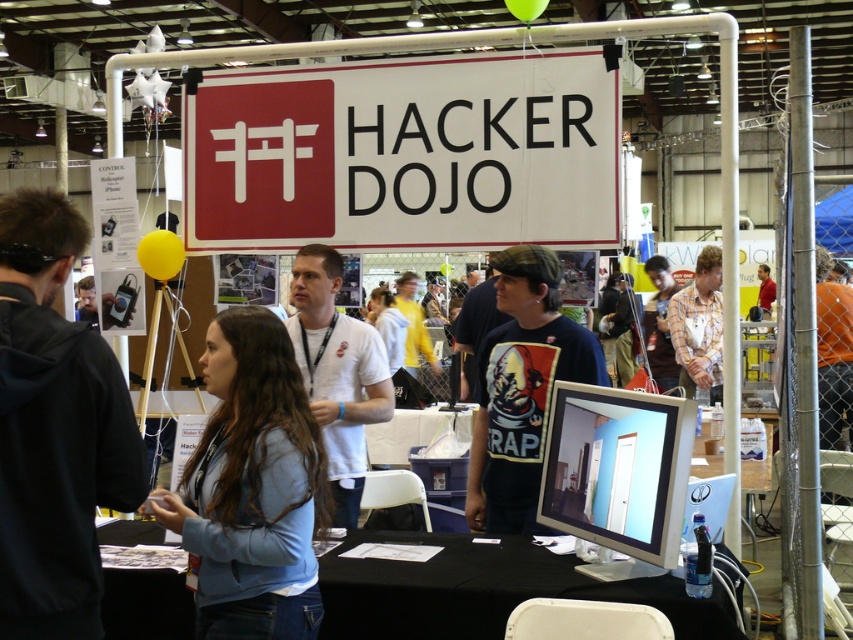
Question: Is plaid fabric shirt at center smaller than red shirt at center?

Choices:
 (A) no
 (B) yes

Answer: (B)

Question: Does plaid fabric shirt at center have a greater width compared to red shirt at center?

Choices:
 (A) yes
 (B) no

Answer: (B)

Question: Among these objects, which one is farthest from the camera?

Choices:
 (A) plaid fabric shirt at center
 (B) red shirt at center
 (C) dark blue t-shirt at center

Answer: (B)

Question: Estimate the real-world distances between objects in this image. Which object is farther from the orange shirt at center?

Choices:
 (A) black matte table at lower center
 (B) dark blue hoodie at left
 (C) plaid shirt at center
 (D) plaid fabric shirt at center

Answer: (B)

Question: Is plaid shirt at center further to camera compared to plaid fabric shirt at center?

Choices:
 (A) yes
 (B) no

Answer: (B)

Question: Based on their relative distances, which object is farther from the red shirt at center?

Choices:
 (A) black matte table at lower center
 (B) plaid shirt at center

Answer: (A)